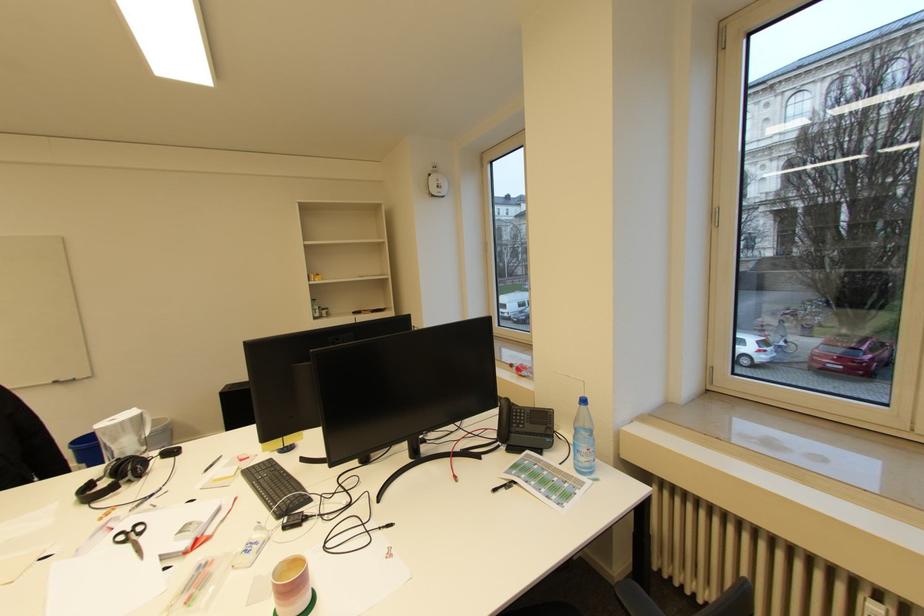
Image resolution: width=924 pixels, height=616 pixels. Describe the element at coordinates (582, 440) in the screenshot. I see `the clear water bottle` at that location.